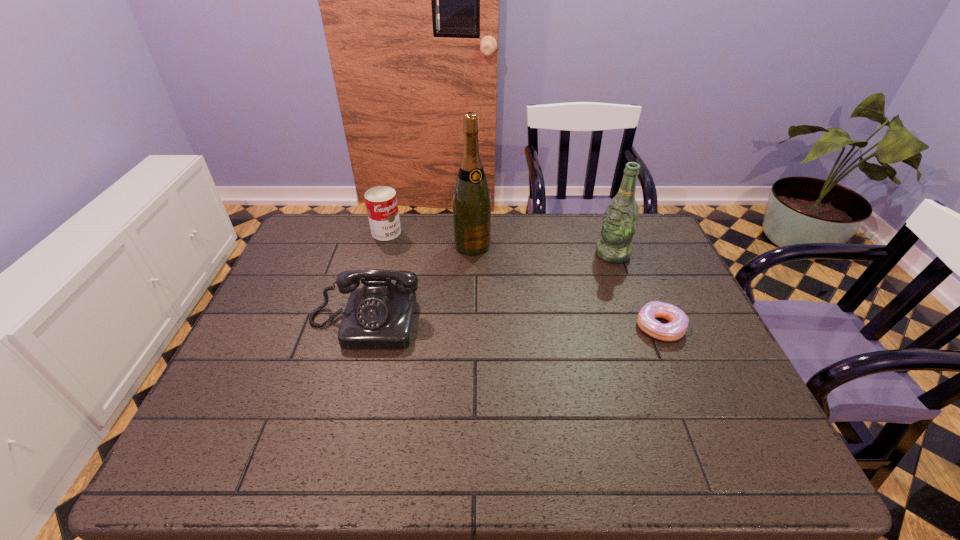
This screenshot has width=960, height=540. What are the coordinates of `free spot between the fourth shortest object and the telephone` in the screenshot? It's located at (489, 288).

You are a GUI agent. You are given a task and a screenshot of the screen. Output one action in this format:
    pyautogui.click(x=<x>, y=<y>)
    Task: Click on the free spot between the third object from left to right and the shortest object
    The height and width of the screenshot is (540, 960).
    Given the screenshot: What is the action you would take?
    (566, 286)

Identify the location of vacant space that is in between the can and the tallest object. (429, 239).

This screenshot has width=960, height=540. I want to click on free area in between the can and the wine bottle, so click(429, 239).

What are the coordinates of `free space that is in between the fourth shortest object and the shortest object` in the screenshot? It's located at (636, 291).

Locate an element on the screen. vacant space that's between the can and the second tallest object is located at coordinates (499, 243).

In order to click on free space that is in between the beer bottle and the telephone in this screenshot , I will do `click(489, 288)`.

Point out which object is positioned as the nearest to the second tallest object. Please provide its 2D coordinates. Your answer should be formatted as a tuple, i.e. [(x, y)], where the tuple contains the x and y coordinates of a point satisfying the conditions above.

[(678, 323)]

Identify which object is the third closest to the telephone. Please provide its 2D coordinates. Your answer should be formatted as a tuple, i.e. [(x, y)], where the tuple contains the x and y coordinates of a point satisfying the conditions above.

[(620, 219)]

This screenshot has height=540, width=960. I want to click on free space that satisfies the following two spatial constraints: 1. on the dial of the doughnut; 2. on the right side of the telephone, so click(x=363, y=327).